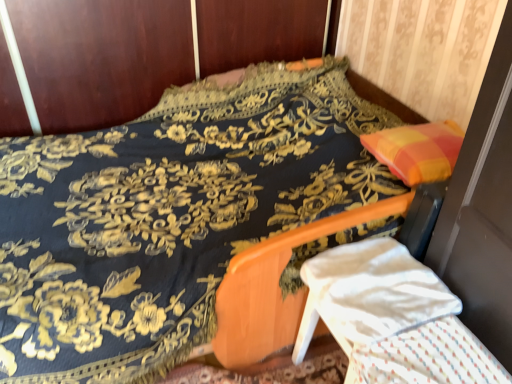
Question: Considering the relative sizes of white fabric armchair at lower right and white textured blanket at lower right in the image provided, is white fabric armchair at lower right smaller than white textured blanket at lower right?

Choices:
 (A) yes
 (B) no

Answer: (B)

Question: Can you confirm if white fabric armchair at lower right is bigger than white textured blanket at lower right?

Choices:
 (A) yes
 (B) no

Answer: (A)

Question: Is white fabric armchair at lower right closer to the viewer compared to white textured blanket at lower right?

Choices:
 (A) no
 (B) yes

Answer: (A)

Question: Is white fabric armchair at lower right with white textured blanket at lower right?

Choices:
 (A) no
 (B) yes

Answer: (B)

Question: Is white fabric armchair at lower right further to the viewer compared to white textured blanket at lower right?

Choices:
 (A) no
 (B) yes

Answer: (B)

Question: From the image's perspective, would you say white fabric armchair at lower right is positioned over white textured blanket at lower right?

Choices:
 (A) no
 (B) yes

Answer: (B)

Question: Is white textured blanket at lower right further to the viewer compared to white fabric armchair at lower right?

Choices:
 (A) no
 (B) yes

Answer: (A)

Question: Is white textured blanket at lower right thinner than white fabric armchair at lower right?

Choices:
 (A) no
 (B) yes

Answer: (A)

Question: Does white textured blanket at lower right turn towards white fabric armchair at lower right?

Choices:
 (A) yes
 (B) no

Answer: (B)

Question: Does white textured blanket at lower right have a greater height compared to white fabric armchair at lower right?

Choices:
 (A) yes
 (B) no

Answer: (B)

Question: From the image's perspective, is white textured blanket at lower right on white fabric armchair at lower right?

Choices:
 (A) no
 (B) yes

Answer: (A)

Question: Is white textured blanket at lower right wider than white fabric armchair at lower right?

Choices:
 (A) yes
 (B) no

Answer: (A)

Question: Is white fabric armchair at lower right wider or thinner than white textured blanket at lower right?

Choices:
 (A) thin
 (B) wide

Answer: (A)